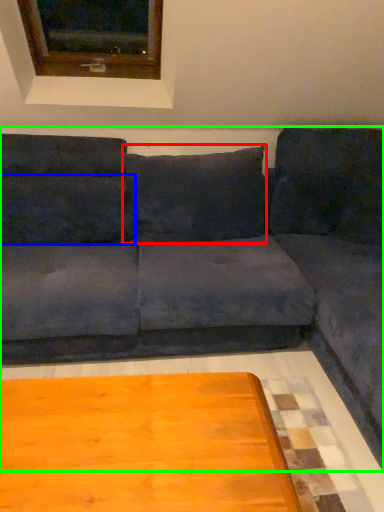
Question: Estimate the real-world distances between objects in this image. Which object is farther from pillow (highlighted by a red box), pillow (highlighted by a blue box) or studio couch (highlighted by a green box)?

Choices:
 (A) pillow
 (B) studio couch

Answer: (A)